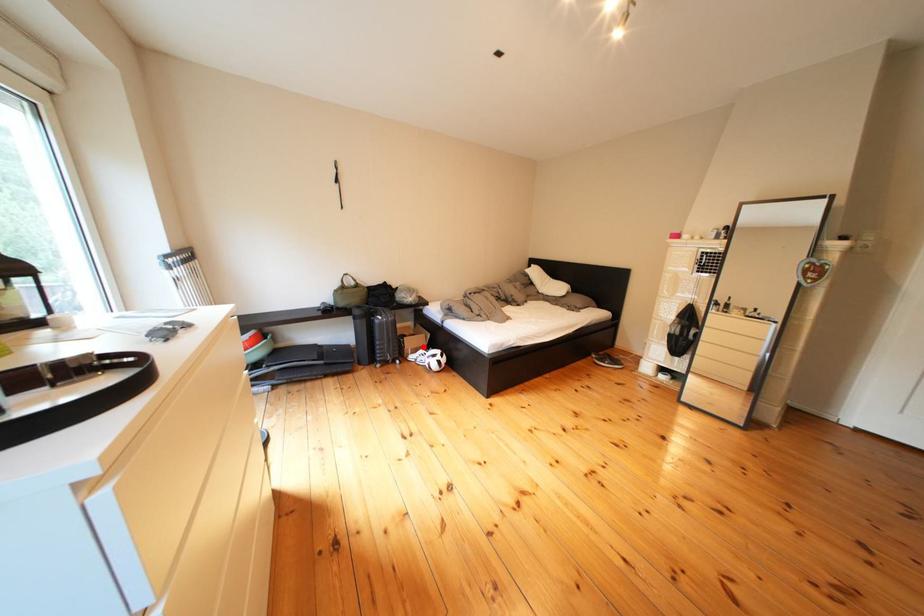
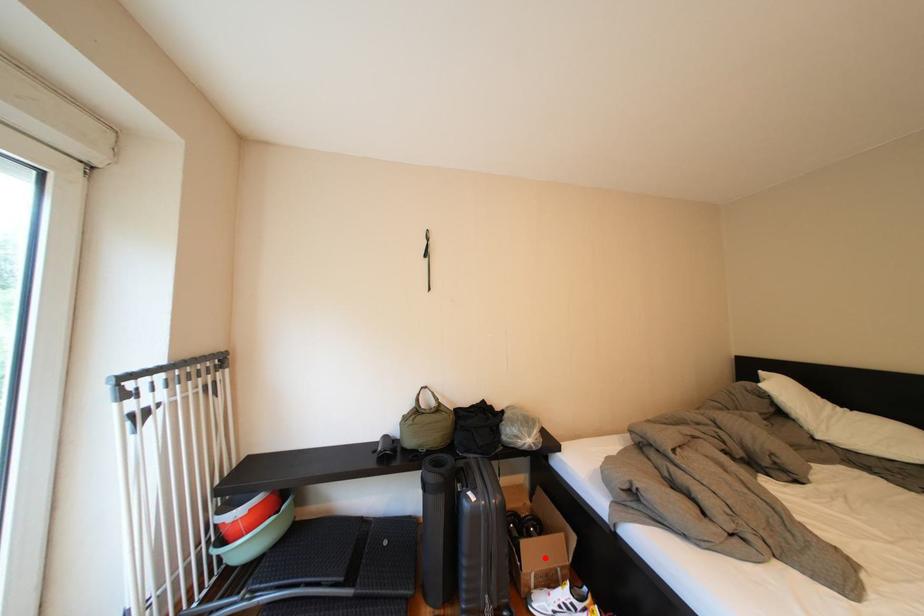
I am providing you with two images of the same scene from different viewpoints. A red point is marked on the first image and another point is marked on the second image. Are the points marked in image1 and image2 representing the same 3D position?

Yes